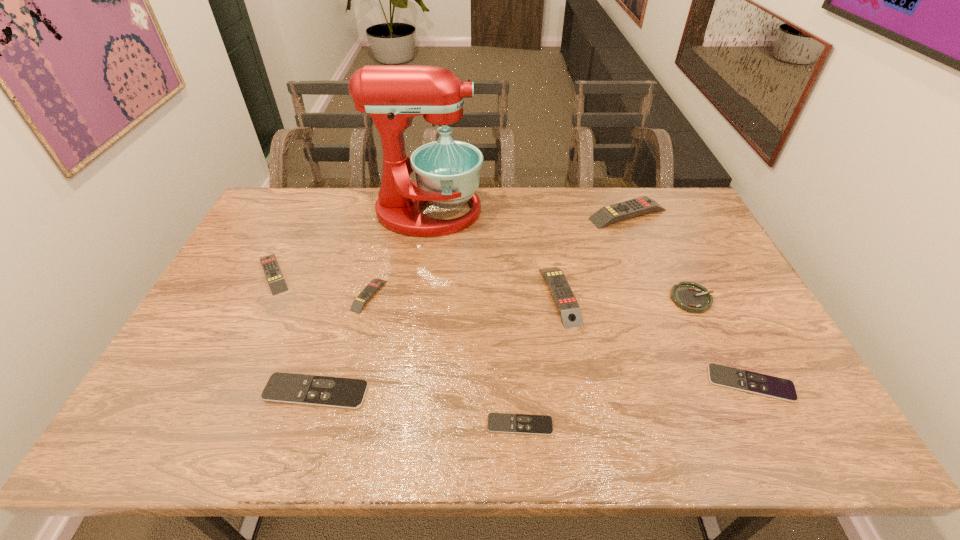
Find the location of a particular element. red mixer is located at coordinates (447, 172).

You are a GUI agent. You are given a task and a screenshot of the screen. Output one action in this format:
    pyautogui.click(x=<x>, y=<y>)
    Task: Click on the mixer
    
    Given the screenshot: What is the action you would take?
    pyautogui.click(x=447, y=172)

The image size is (960, 540). In order to click on the biggest yellow remote control in this screenshot , I will do `click(609, 214)`.

Image resolution: width=960 pixels, height=540 pixels. Identify the location of the farthest yellow remote control. (609, 214).

Locate an element on the screen. the second biggest yellow remote control is located at coordinates (565, 301).

Locate an element on the screen. This screenshot has height=540, width=960. the sixth shortest remote control is located at coordinates (565, 301).

Where is `the leftmost object`? the leftmost object is located at coordinates (277, 284).

Locate an element on the screen. the leftmost yellow remote control is located at coordinates (277, 284).

This screenshot has height=540, width=960. What are the coordinates of `ashtray` in the screenshot? It's located at (691, 297).

This screenshot has height=540, width=960. Find the location of `the second yellow remote control from left to right`. the second yellow remote control from left to right is located at coordinates (368, 292).